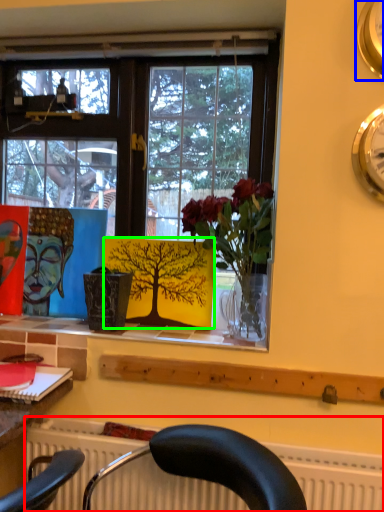
Question: Which object is positioned closest to radiator (highlighted by a red box)? Select from clock (highlighted by a blue box) and plant (highlighted by a green box).

Choices:
 (A) clock
 (B) plant

Answer: (B)